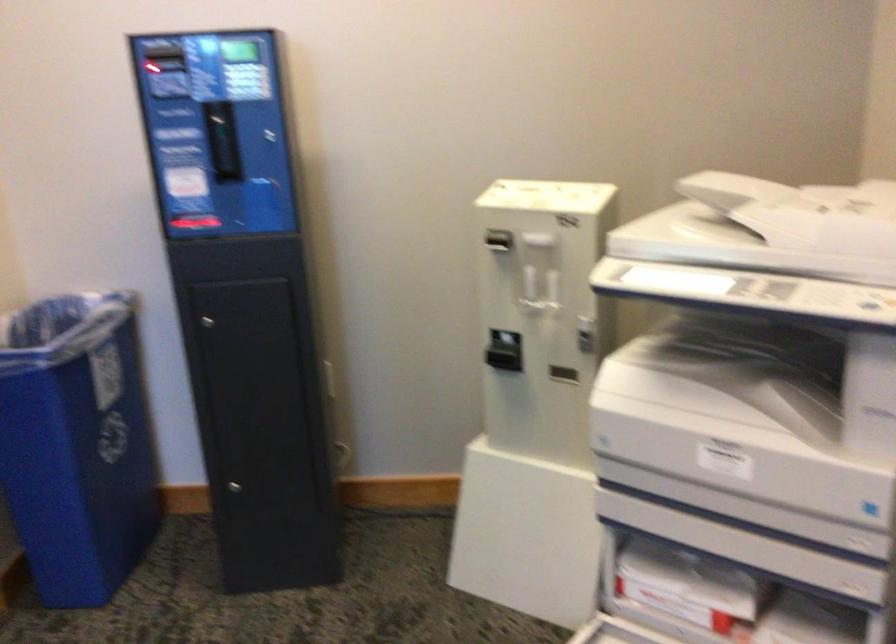
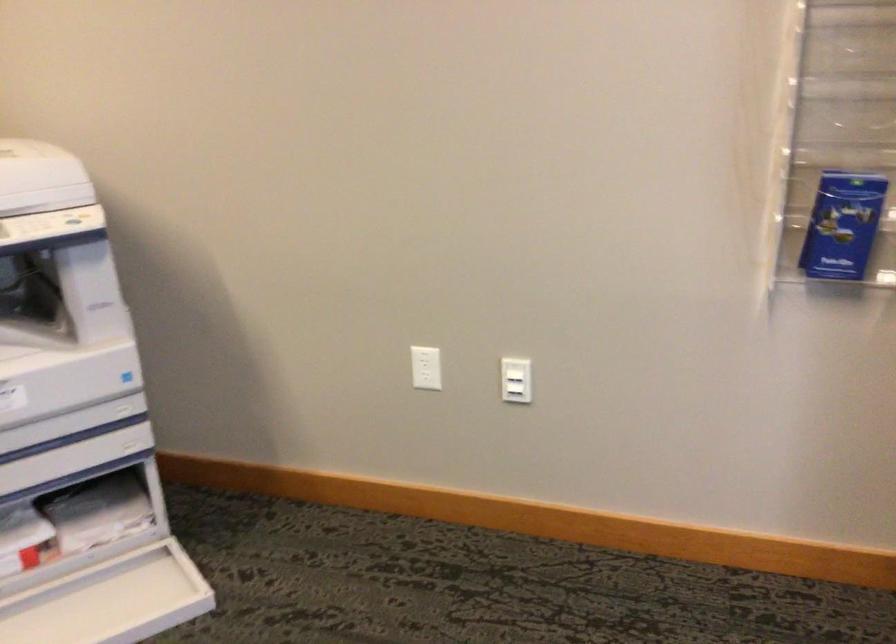
Question: The images are taken continuously from a first-person perspective. In which direction is your viewpoint rotating?

Choices:
 (A) Left
 (B) Right
 (C) Up
 (D) Down

Answer: (B)